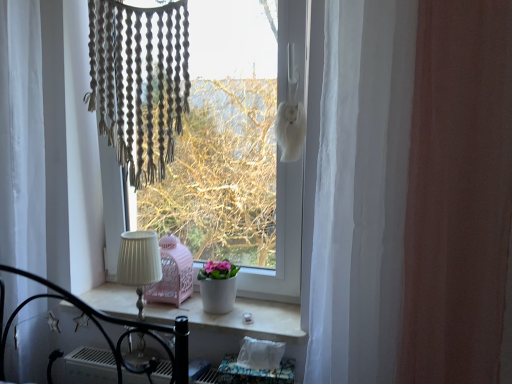
Where is `vacant space in front of white matte pot at center`? The height and width of the screenshot is (384, 512). vacant space in front of white matte pot at center is located at coordinates (227, 323).